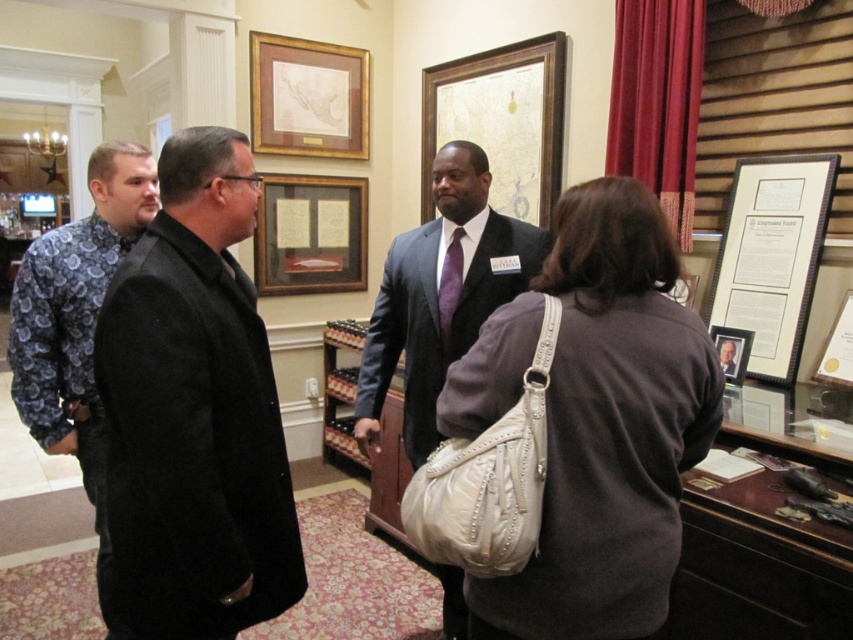
Can you confirm if matte white purse at center is shorter than matte gold picture frame at right?

In fact, matte white purse at center may be taller than matte gold picture frame at right.

Does matte white purse at center have a larger size compared to matte gold picture frame at right?

Indeed, matte white purse at center has a larger size compared to matte gold picture frame at right.

This screenshot has width=853, height=640. I want to click on matte white purse at center, so click(596, 420).

Between black wool coat at center and matte white purse at center, which one appears on the right side from the viewer's perspective?

matte white purse at center

This screenshot has height=640, width=853. What do you see at coordinates (194, 412) in the screenshot? I see `black wool coat at center` at bounding box center [194, 412].

At what (x,y) coordinates should I click in order to perform the action: click on black wool coat at center. Please return your answer as a coordinate pair (x, y). Looking at the image, I should click on (194, 412).

Is black wool coat at center positioned before dark gray suit at center?

Yes, black wool coat at center is closer to the viewer.

Who is more forward, (144, 440) or (511, 275)?

Positioned in front is point (144, 440).

At what (x,y) coordinates should I click in order to perform the action: click on black wool coat at center. Please return your answer as a coordinate pair (x, y). The width and height of the screenshot is (853, 640). Looking at the image, I should click on (194, 412).